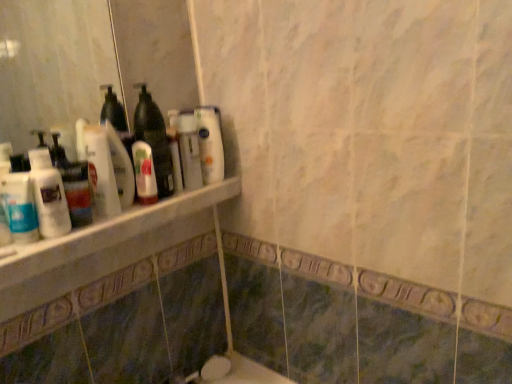
The height and width of the screenshot is (384, 512). I want to click on translucent plastic bottle at left, which is the first cleaning product from front to back, so click(49, 195).

This screenshot has height=384, width=512. In order to click on white glossy bottle at upper center, which is the first cleaning product in back-to-front order in this screenshot , I will do `click(210, 144)`.

In order to click on mirror above the translucent plastic mouthwash at shelf center, which appears as the second mouthwash when viewed from the left (from the image's perspective) in this screenshot , I will do `click(53, 66)`.

From the image's perspective, who appears lower, translucent plastic mouthwash at shelf center, which appears as the second mouthwash when viewed from the left, or white glossy bottles at upper left?

translucent plastic mouthwash at shelf center, which appears as the second mouthwash when viewed from the left.

Looking at this image, in the image, is white glossy bottle at upper center, arranged as the third cleaning product when viewed from the front, on the left side or the right side of white marble ledge at upper left?

Clearly, white glossy bottle at upper center, arranged as the third cleaning product when viewed from the front, is on the right of white marble ledge at upper left in the image.

Is white glossy bottle at upper center, which is the first cleaning product in back-to-front order, oriented towards white marble ledge at upper left?

No.

How many degrees apart are the facing directions of white glossy bottle at upper center, which is the first cleaning product in back-to-front order, and white marble ledge at upper left?

6.17 degrees.

From the image's perspective, does white glossy bottle at upper center, the third cleaning product from the left, appear higher than white marble ledge at upper left?

Yes, from the image's perspective, white glossy bottle at upper center, the third cleaning product from the left, is on top of white marble ledge at upper left.

Consider the image. Is white marble ledge at upper left looking in the opposite direction of translucent plastic mouthwash at shelf center, which ranks as the 1th mouthwash in back-to-front order?

No, white marble ledge at upper left is not facing the opposite direction of translucent plastic mouthwash at shelf center, which ranks as the 1th mouthwash in back-to-front order.

Is white marble ledge at upper left touching translucent plastic mouthwash at shelf center, the 2th mouthwash in the front-to-back sequence?

They are not placed beside each other.

Does white marble ledge at upper left have a smaller size compared to translucent plastic mouthwash at shelf center, the 2th mouthwash in the front-to-back sequence?

Incorrect, white marble ledge at upper left is not smaller in size than translucent plastic mouthwash at shelf center, the 2th mouthwash in the front-to-back sequence.

From their relative heights in the image, would you say white marble ledge at upper left is taller or shorter than translucent plastic mouthwash at shelf center, the 2th mouthwash in the front-to-back sequence?

Clearly, white marble ledge at upper left is shorter compared to translucent plastic mouthwash at shelf center, the 2th mouthwash in the front-to-back sequence.

From a real-world perspective, is translucent plastic mouthwash at shelf center, which ranks as the 1th mouthwash in back-to-front order, physically below white glossy bottle at upper center, which is the first cleaning product in back-to-front order?

Correct, in the physical world, translucent plastic mouthwash at shelf center, which ranks as the 1th mouthwash in back-to-front order, is lower than white glossy bottle at upper center, which is the first cleaning product in back-to-front order.

In terms of height, does translucent plastic mouthwash at shelf center, the 1th mouthwash in the right-to-left sequence, look taller or shorter compared to white glossy bottle at upper center, the third cleaning product from the left?

translucent plastic mouthwash at shelf center, the 1th mouthwash in the right-to-left sequence, is shorter than white glossy bottle at upper center, the third cleaning product from the left.

Is translucent plastic mouthwash at shelf center, the 1th mouthwash in the right-to-left sequence, with white glossy bottle at upper center, arranged as the third cleaning product when viewed from the front?

No, translucent plastic mouthwash at shelf center, the 1th mouthwash in the right-to-left sequence, is not in contact with white glossy bottle at upper center, arranged as the third cleaning product when viewed from the front.

Between translucent plastic mouthwash at shelf center, the 2th mouthwash in the front-to-back sequence, and white glossy bottle at upper center, arranged as the third cleaning product when viewed from the front, which one appears on the right side from the viewer's perspective?

white glossy bottle at upper center, arranged as the third cleaning product when viewed from the front.

Considering the sizes of objects white glossy bottles at upper left and white glossy mouthwash at left, the first mouthwash from the front, in the image provided, who is shorter, white glossy bottles at upper left or white glossy mouthwash at left, the first mouthwash from the front,?

white glossy mouthwash at left, the first mouthwash from the front, is shorter.

In terms of width, does white glossy bottles at upper left look wider or thinner when compared to white glossy mouthwash at left, placed as the 1th mouthwash when sorted from left to right?

white glossy bottles at upper left is thinner than white glossy mouthwash at left, placed as the 1th mouthwash when sorted from left to right.

Between white glossy bottles at upper left and white glossy mouthwash at left, positioned as the 2th mouthwash in right-to-left order, which one has larger size?

Bigger between the two is white glossy bottles at upper left.

From a real-world perspective, between white glossy bottles at upper left and white glossy mouthwash at left, placed as the 1th mouthwash when sorted from left to right, who is vertically lower?

In real-world perspective, white glossy mouthwash at left, placed as the 1th mouthwash when sorted from left to right, is lower.

Is white glossy bottle at upper center, which is counted as the 1th cleaning product, starting from the right, to the left of translucent plastic bottle at upper left, the second cleaning product in the back-to-front sequence, from the viewer's perspective?

No.

Is white glossy bottle at upper center, the third cleaning product from the left, looking in the opposite direction of translucent plastic bottle at upper left, acting as the 2th cleaning product starting from the right?

No, white glossy bottle at upper center, the third cleaning product from the left,'s orientation is not away from translucent plastic bottle at upper left, acting as the 2th cleaning product starting from the right.

From the image's perspective, between white glossy bottle at upper center, which is the first cleaning product in back-to-front order, and translucent plastic bottle at upper left, acting as the 2th cleaning product starting from the right, which one is located above?

From the image's view, white glossy bottle at upper center, which is the first cleaning product in back-to-front order, is above.

Considering the sizes of objects translucent plastic bottle at upper left, the second cleaning product in the back-to-front sequence, and white glossy mouthwash at left, positioned as the 2th mouthwash in right-to-left order, in the image provided, who is shorter, translucent plastic bottle at upper left, the second cleaning product in the back-to-front sequence, or white glossy mouthwash at left, positioned as the 2th mouthwash in right-to-left order,?

Standing shorter between the two is white glossy mouthwash at left, positioned as the 2th mouthwash in right-to-left order.

From a real-world perspective, is translucent plastic bottle at upper left, the 2th cleaning product when ordered from left to right, positioned over white glossy mouthwash at left, positioned as the 2th mouthwash in right-to-left order, based on gravity?

Correct, in the physical world, translucent plastic bottle at upper left, the 2th cleaning product when ordered from left to right, is higher than white glossy mouthwash at left, positioned as the 2th mouthwash in right-to-left order.

Could you tell me if translucent plastic bottle at upper left, the second cleaning product in the back-to-front sequence, is facing white glossy mouthwash at left, positioned as the 2th mouthwash in right-to-left order?

No.

Is point (106, 134) behind point (21, 215)?

Yes, it is behind point (21, 215).

The height and width of the screenshot is (384, 512). I want to click on mirror in front of the translucent plastic mouthwash at shelf center, which appears as the second mouthwash when viewed from the left, so click(x=53, y=66).

This screenshot has height=384, width=512. I want to click on the 3rd cleaning product behind the white marble ledge at upper left, so click(210, 144).

Based on their spatial positions, is translucent plastic bottle at center or white glossy mouthwash at left, the first mouthwash from the front, further from translucent plastic bottle at upper left, the second cleaning product in the back-to-front sequence?

white glossy mouthwash at left, the first mouthwash from the front, is positioned further to the anchor translucent plastic bottle at upper left, the second cleaning product in the back-to-front sequence.

Based on their spatial positions, is white glossy bottle at upper center, which is counted as the 1th cleaning product, starting from the right, or translucent plastic mouthwash at shelf center, which appears as the second mouthwash when viewed from the left, further from translucent plastic bottle at left, the 1th cleaning product viewed from the left?

The object further to translucent plastic bottle at left, the 1th cleaning product viewed from the left, is white glossy bottle at upper center, which is counted as the 1th cleaning product, starting from the right.

From the image, which object appears to be farther from white glossy bottle at upper center, which is the first cleaning product in back-to-front order, white glossy bottles at upper left or translucent plastic mouthwash at shelf center, the 2th mouthwash in the front-to-back sequence?

white glossy bottles at upper left is further to white glossy bottle at upper center, which is the first cleaning product in back-to-front order.

Considering their positions, is white glossy bottle at upper center, arranged as the third cleaning product when viewed from the front, positioned further to translucent plastic bottle at left, the 1th cleaning product viewed from the left, than white glossy mouthwash at left, which is the second mouthwash in back-to-front order?

white glossy bottle at upper center, arranged as the third cleaning product when viewed from the front, is further to translucent plastic bottle at left, the 1th cleaning product viewed from the left.

Based on their spatial positions, is white marble ledge at upper left or translucent plastic bottle at center closer to translucent plastic bottle at upper left, the 2th cleaning product when ordered from left to right?

translucent plastic bottle at center lies closer to translucent plastic bottle at upper left, the 2th cleaning product when ordered from left to right, than the other object.

Considering their positions, is translucent plastic bottle at left, the 1th cleaning product viewed from the left, positioned closer to white marble ledge at upper left than translucent plastic mouthwash at shelf center, which ranks as the 1th mouthwash in back-to-front order?

translucent plastic mouthwash at shelf center, which ranks as the 1th mouthwash in back-to-front order, lies closer to white marble ledge at upper left than the other object.

From the image, which object appears to be nearer to white marble ledge at upper left, white glossy bottles at upper left or translucent plastic bottle at left, the 1th cleaning product viewed from the left?

translucent plastic bottle at left, the 1th cleaning product viewed from the left.

Consider the image. Based on their spatial positions, is white glossy bottles at upper left or translucent plastic bottle at upper left, the second cleaning product in the back-to-front sequence, closer to translucent plastic bottle at left, the third cleaning product when ordered from back to front?

translucent plastic bottle at upper left, the second cleaning product in the back-to-front sequence, lies closer to translucent plastic bottle at left, the third cleaning product when ordered from back to front, than the other object.

Locate an element on the screen. The image size is (512, 384). cleaning product positioned between translucent plastic bottle at left, which is the first cleaning product from front to back, and translucent plastic mouthwash at shelf center, the 2th mouthwash in the front-to-back sequence, from near to far is located at coordinates (101, 172).

Locate an element on the screen. cleaning product between white glossy mouthwash at left, placed as the 1th mouthwash when sorted from left to right, and translucent plastic bottle at upper left, acting as the 2th cleaning product starting from the right, from left to right is located at coordinates (49, 195).

I want to click on bottle positioned between white marble ledge at upper left and white glossy bottle at upper center, which is counted as the 1th cleaning product, starting from the right, from near to far, so click(154, 139).

Locate an element on the screen. This screenshot has height=384, width=512. cleaning product between translucent plastic bottle at left, acting as the 3th cleaning product starting from the right, and white glossy bottle at upper center, the third cleaning product from the left, from front to back is located at coordinates (101, 172).